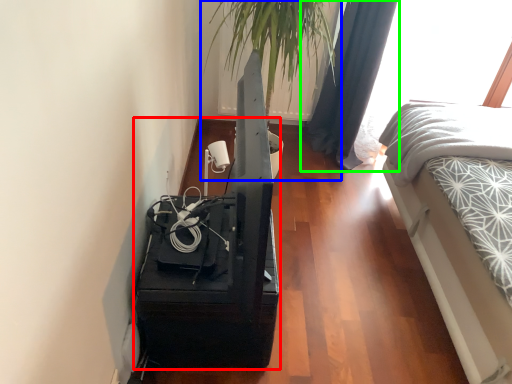
Question: Which is farther away from furniture (highlighted by a red box)? houseplant (highlighted by a blue box) or curtain (highlighted by a green box)?

Choices:
 (A) houseplant
 (B) curtain

Answer: (B)